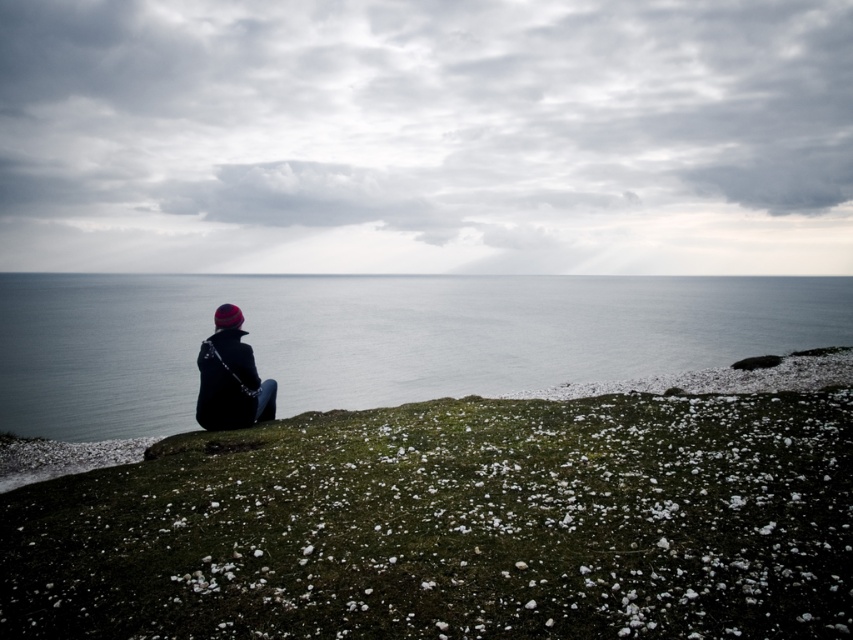
Question: Does green mossy grass at center appear on the right side of dark blue fabric jacket at center?

Choices:
 (A) no
 (B) yes

Answer: (B)

Question: Observing the image, what is the correct spatial positioning of smooth blue water at center in reference to dark blue fabric jacket at center?

Choices:
 (A) below
 (B) above

Answer: (B)

Question: Which point is farther from the camera taking this photo?

Choices:
 (A) (248, 317)
 (B) (737, 486)
 (C) (263, 381)

Answer: (A)

Question: Considering the real-world distances, which object is closest to the green mossy grass at center?

Choices:
 (A) smooth blue water at center
 (B) dark blue fabric jacket at center

Answer: (B)

Question: Which point is closer to the camera?

Choices:
 (A) smooth blue water at center
 (B) dark blue fabric jacket at center
 (C) green mossy grass at center

Answer: (C)

Question: Is smooth blue water at center further to the viewer compared to dark blue fabric jacket at center?

Choices:
 (A) no
 (B) yes

Answer: (B)